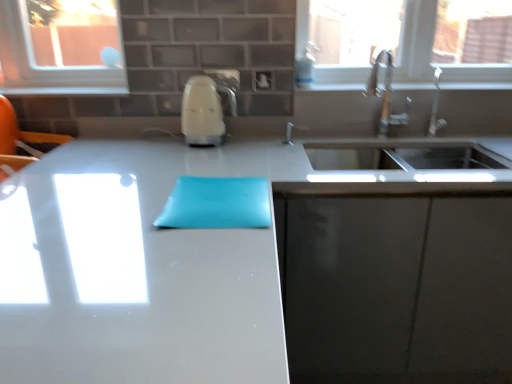
Where is `transparent glass window at upper right`? This screenshot has height=384, width=512. transparent glass window at upper right is located at coordinates (406, 39).

The height and width of the screenshot is (384, 512). What do you see at coordinates (204, 111) in the screenshot?
I see `white glossy kettle at center` at bounding box center [204, 111].

What do you see at coordinates (397, 287) in the screenshot?
I see `matte gray cabinet at lower right` at bounding box center [397, 287].

The width and height of the screenshot is (512, 384). I want to click on white glossy countertop at center, so click(x=249, y=270).

Identify the location of satin nickel faucet at upper right. (436, 106).

This screenshot has width=512, height=384. What are the coordinates of `transparent glass window at upper right` in the screenshot? It's located at (406, 39).

Can you confirm if satin nickel faucet at upper right is smaller than white glossy kettle at center?

Yes, satin nickel faucet at upper right is smaller than white glossy kettle at center.

Considering their positions, is satin nickel faucet at upper right located in front of or behind white glossy kettle at center?

satin nickel faucet at upper right is behind white glossy kettle at center.

Which is less distant, (440, 75) or (220, 127)?

Point (440, 75) is farther from the camera than point (220, 127).

Is white glossy kettle at center a part of satin nickel faucet at upper right?

That's incorrect, white glossy kettle at center is not inside satin nickel faucet at upper right.

Which is closer, (361, 84) or (342, 305)?

Positioned in front is point (342, 305).

Between white glossy window sill at upper center and white glossy countertop at center, which one has smaller width?

white glossy window sill at upper center.

The height and width of the screenshot is (384, 512). In order to click on countertop that appears in front of the white glossy window sill at upper center in this screenshot , I will do `click(249, 270)`.

Looking at this image, how many degrees apart are the facing directions of white glossy window sill at upper center and white glossy countertop at center?

They differ by 90.3 degrees in their facing directions.

Looking at their sizes, would you say white glossy kettle at center is wider or thinner than transparent glass window at upper right?

white glossy kettle at center is wider than transparent glass window at upper right.

Would you say white glossy kettle at center is outside transparent glass window at upper right?

Indeed, white glossy kettle at center is completely outside transparent glass window at upper right.

Are white glossy kettle at center and transparent glass window at upper right located far from each other?

No, there isn't a large distance between white glossy kettle at center and transparent glass window at upper right.

In the image, there is a white glossy kettle at center. Identify the location of window above it (from the image's perspective). The width and height of the screenshot is (512, 384). (406, 39).

Could you tell me if white glossy kettle at center is facing white glossy window sill at upper center?

No.

Which object is positioned more to the left, white glossy kettle at center or white glossy window sill at upper center?

white glossy kettle at center.

Looking at this image, from a real-world perspective, who is located higher, white glossy kettle at center or white glossy window sill at upper center?

white glossy window sill at upper center.

Is white glossy kettle at center not within white glossy window sill at upper center?

white glossy kettle at center lies outside white glossy window sill at upper center's area.

Is white glossy window sill at upper center not near matte gray cabinet at lower right?

No, white glossy window sill at upper center is not far from matte gray cabinet at lower right.

Locate an element on the screen. The height and width of the screenshot is (384, 512). window sill located behind the matte gray cabinet at lower right is located at coordinates (476, 86).

Is matte gray cabinet at lower right at the back of white glossy window sill at upper center?

white glossy window sill at upper center is not turned away from matte gray cabinet at lower right.

Based on the photo, is white glossy window sill at upper center looking in the opposite direction of transparent glass window at upper right?

Yes, transparent glass window at upper right is at the back of white glossy window sill at upper center.

This screenshot has width=512, height=384. I want to click on window that appears above the white glossy window sill at upper center (from the image's perspective), so click(406, 39).

Considering the points (379, 89) and (446, 20), which point is behind, point (379, 89) or point (446, 20)?

The point (446, 20) is more distant.

Is the surface of white glossy window sill at upper center in direct contact with transparent glass window at upper right?

No, white glossy window sill at upper center is not next to transparent glass window at upper right.

Who is taller, white glossy window sill at upper center or satin nickel faucet at upper right?

Standing taller between the two is satin nickel faucet at upper right.

Is white glossy window sill at upper center facing away from satin nickel faucet at upper right?

No.

Find the location of a particular element. faucet that is under the white glossy window sill at upper center (from a real-world perspective) is located at coordinates (436, 106).

Locate an element on the screen. Image resolution: width=512 pixels, height=384 pixels. appliance lying on the left of satin nickel faucet at upper right is located at coordinates point(204,111).

Locate an element on the screen. Image resolution: width=512 pixels, height=384 pixels. window sill behind the white glossy countertop at center is located at coordinates (476, 86).

From the picture: Based on their spatial positions, is matte gray cabinet at lower right or white glossy countertop at center further from satin nickel faucet at upper right?

Based on the image, white glossy countertop at center appears to be further to satin nickel faucet at upper right.

Considering their positions, is white glossy countertop at center positioned further to white glossy window sill at upper center than matte gray cabinet at lower right?

Among the two, white glossy countertop at center is located further to white glossy window sill at upper center.

Considering their positions, is satin nickel faucet at upper right positioned further to transparent glass window at upper right than white glossy window sill at upper center?

satin nickel faucet at upper right.

Based on their spatial positions, is transparent glass window at upper right or white glossy countertop at center closer to white glossy kettle at center?

Among the two, transparent glass window at upper right is located nearer to white glossy kettle at center.

Estimate the real-world distances between objects in this image. Which object is closer to transparent glass window at upper right, white glossy kettle at center or white glossy countertop at center?

white glossy kettle at center lies closer to transparent glass window at upper right than the other object.

Looking at this image, which object lies nearer to the anchor point satin nickel faucet at upper right, white glossy countertop at center or transparent glass window at upper right?

transparent glass window at upper right is positioned closer to the anchor satin nickel faucet at upper right.

Considering their positions, is white glossy countertop at center positioned further to white glossy kettle at center than matte gray cabinet at lower right?

matte gray cabinet at lower right lies further to white glossy kettle at center than the other object.

Estimate the real-world distances between objects in this image. Which object is closer to white glossy kettle at center, white glossy window sill at upper center or white glossy countertop at center?

white glossy window sill at upper center lies closer to white glossy kettle at center than the other object.

Locate an element on the screen. The width and height of the screenshot is (512, 384). window between white glossy kettle at center and satin nickel faucet at upper right in the horizontal direction is located at coordinates [x=406, y=39].

In order to click on faucet between white glossy window sill at upper center and matte gray cabinet at lower right vertically in this screenshot , I will do `click(436, 106)`.

The image size is (512, 384). I want to click on cabinetry between white glossy countertop at center and satin nickel faucet at upper right in the horizontal direction, so click(397, 287).

The width and height of the screenshot is (512, 384). I want to click on appliance between white glossy countertop at center and matte gray cabinet at lower right in the horizontal direction, so click(204, 111).